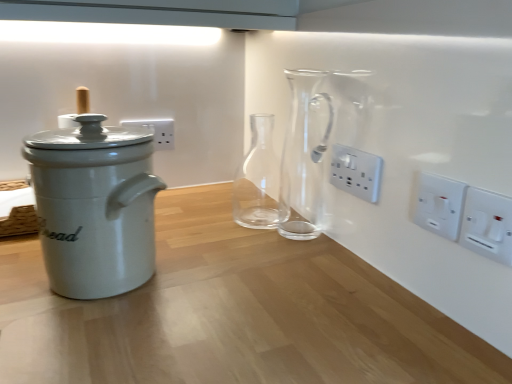
Question: From a real-world perspective, is white plastic electrical outlet at center-right, the 3th electric outlet viewed from the right, physically above white plastic switch at right, arranged as the second electric outlet when viewed from the front?

Choices:
 (A) yes
 (B) no

Answer: (A)

Question: Considering the relative sizes of white plastic electrical outlet at center-right, the 3th electric outlet when ordered from front to back, and white plastic switch at right, the 2th electric outlet in the left-to-right sequence, in the image provided, is white plastic electrical outlet at center-right, the 3th electric outlet when ordered from front to back, shorter than white plastic switch at right, the 2th electric outlet in the left-to-right sequence,?

Choices:
 (A) no
 (B) yes

Answer: (B)

Question: Does white plastic electrical outlet at center-right, the 1th electric outlet in the back-to-front sequence, appear on the right side of white plastic switch at right, arranged as the second electric outlet when viewed from the front?

Choices:
 (A) no
 (B) yes

Answer: (A)

Question: From the image's perspective, would you say white plastic electrical outlet at center-right, arranged as the first electric outlet when viewed from the left, is positioned over white plastic switch at right, the 2th electric outlet in the left-to-right sequence?

Choices:
 (A) no
 (B) yes

Answer: (B)

Question: Would you say white plastic electrical outlet at center-right, the 3th electric outlet when ordered from front to back, contains white plastic switch at right, which is the 2th electric outlet in back-to-front order?

Choices:
 (A) no
 (B) yes

Answer: (A)

Question: Is white plastic electrical outlet at center-right, the 3th electric outlet when ordered from front to back, further to camera compared to white plastic switch at right, which is the 2th electric outlet in back-to-front order?

Choices:
 (A) no
 (B) yes

Answer: (B)

Question: Is white ceramic bread bin at left positioned in front of transparent glass carafe at center, the first glass vase positioned from the front?

Choices:
 (A) yes
 (B) no

Answer: (A)

Question: Is white ceramic bread bin at left thinner than transparent glass carafe at center, the 2th glass vase in the back-to-front sequence?

Choices:
 (A) no
 (B) yes

Answer: (A)

Question: From a real-world perspective, does white ceramic bread bin at left stand above transparent glass carafe at center, the 2th glass vase in the back-to-front sequence?

Choices:
 (A) no
 (B) yes

Answer: (A)

Question: Can you confirm if white ceramic bread bin at left is taller than transparent glass carafe at center, the first glass vase positioned from the front?

Choices:
 (A) yes
 (B) no

Answer: (B)

Question: Is white ceramic bread bin at left facing away from transparent glass carafe at center, the 2th glass vase in the back-to-front sequence?

Choices:
 (A) yes
 (B) no

Answer: (B)

Question: Considering the relative sizes of white ceramic bread bin at left and transparent glass carafe at center, the 2th glass vase in the back-to-front sequence, in the image provided, is white ceramic bread bin at left bigger than transparent glass carafe at center, the 2th glass vase in the back-to-front sequence,?

Choices:
 (A) no
 (B) yes

Answer: (B)

Question: Is brown woven basket at left facing towards white plastic switch at right, which is the second electric outlet in right-to-left order?

Choices:
 (A) yes
 (B) no

Answer: (B)